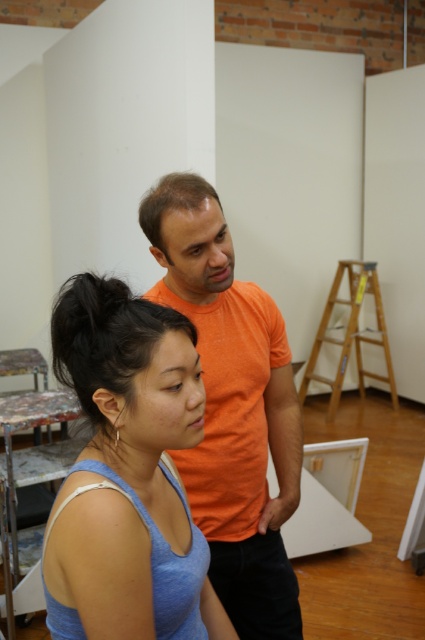
In the art studio scene, you see a blue cotton tank top at lower left and a black shiny hair at center. Which object is positioned to the right of the other?

The blue cotton tank top at lower left is to the right of black shiny hair at center.

You are an art student who needs to measure the distance between two objects in the studio for a project. You have a ruler that can measure up to 15 centimeters. Can you accurately measure the distance between the blue cotton tank top at lower left and the black shiny hair at center using your ruler?

The distance between the blue cotton tank top at lower left and the black shiny hair at center is 12.33 centimeters, which is within the ruler measurement limit of 15 centimeters. Therefore, you can accurately measure the distance using your ruler.

You are an artist in the studio and want to hang a small painting between the orange cotton shirt at upper center and the brown matte hair at upper center. Which object should you place the painting closer to so that it doesn

The orange cotton shirt at upper center is larger in size than the brown matte hair at upper center. To ensure the painting is closer to the smaller object, you should place it nearer to the brown matte hair at upper center.